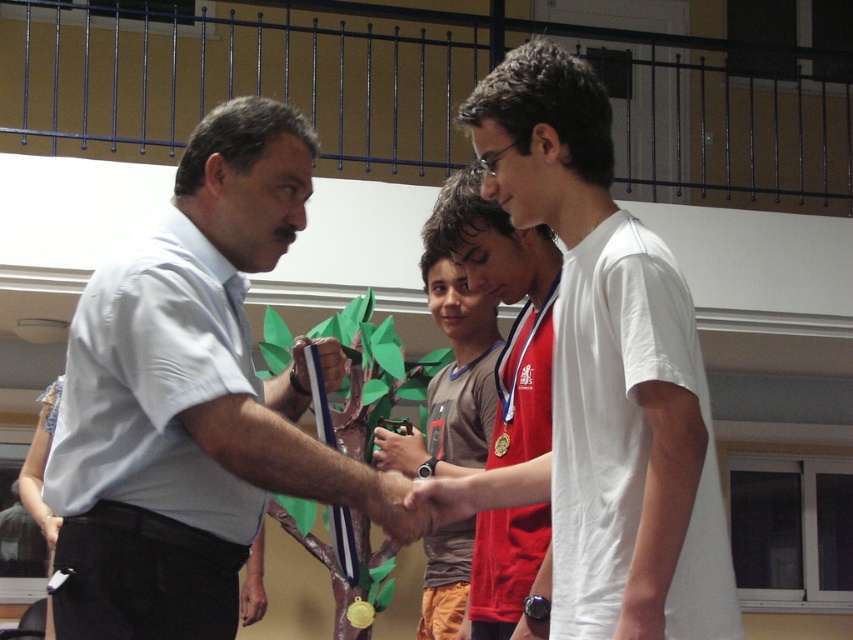
In the scene shown: You are standing in the gymnasium during the award ceremony. You need to locate the person wearing the light blue shirt at center. Which coordinates should you look at?

The light blue shirt at center is located at coordinates point (190, 400).